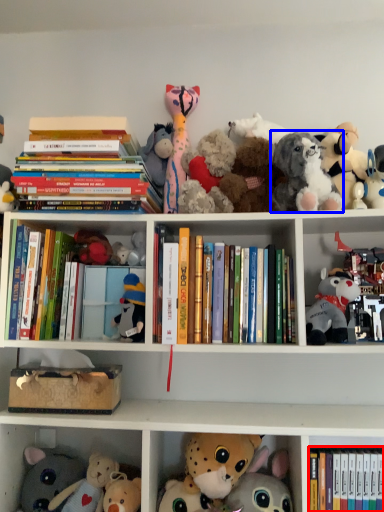
Question: Which point is closer to the camera, book (highlighted by a red box) or toy (highlighted by a blue box)?

Choices:
 (A) book
 (B) toy

Answer: (A)